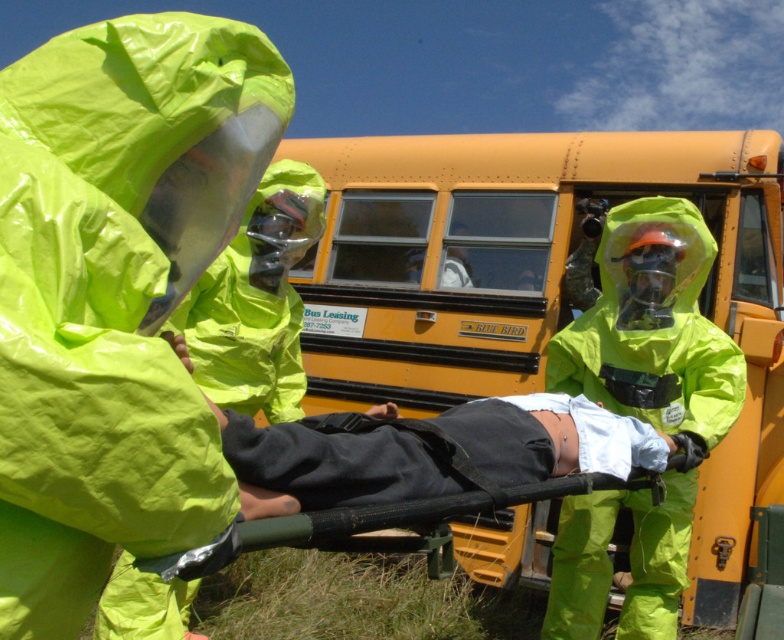
Question: Is neon yellow hazmat suit at center thinner than matte green hazmat suit at center?

Choices:
 (A) no
 (B) yes

Answer: (B)

Question: Which object appears closest to the camera in this image?

Choices:
 (A) black matte stretcher at center
 (B) yellow matte school bus at center
 (C) matte green hazmat suit at center

Answer: (A)

Question: Which of these objects is positioned farthest from the yellow matte school bus at center?

Choices:
 (A) matte green hazmat suit at center
 (B) neon yellow hazmat suit at center
 (C) black fabric stretcher at center
 (D) black matte stretcher at center

Answer: (B)

Question: Can you confirm if matte green hazmat suit at center is thinner than black fabric stretcher at center?

Choices:
 (A) yes
 (B) no

Answer: (A)

Question: Based on their relative distances, which object is nearer to the matte green hazmat suit at center?

Choices:
 (A) black fabric stretcher at center
 (B) neon yellow hazmat suit at center
 (C) yellow matte school bus at center
 (D) black matte stretcher at center

Answer: (A)

Question: Does yellow matte school bus at center have a smaller size compared to matte green hazmat suit at center?

Choices:
 (A) yes
 (B) no

Answer: (B)